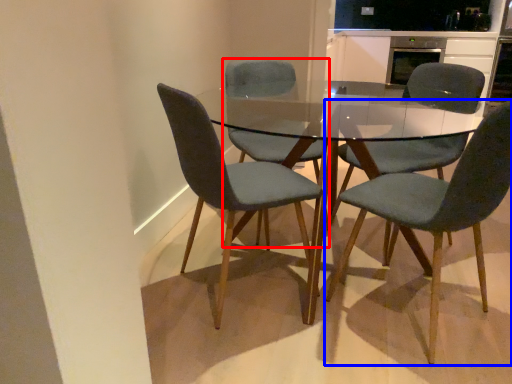
Question: Which object appears farthest to the camera in this image, chair (highlighted by a red box) or chair (highlighted by a blue box)?

Choices:
 (A) chair
 (B) chair

Answer: (A)